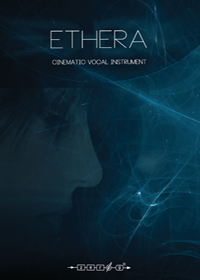
The height and width of the screenshot is (280, 200). I want to click on poster, so click(71, 161).